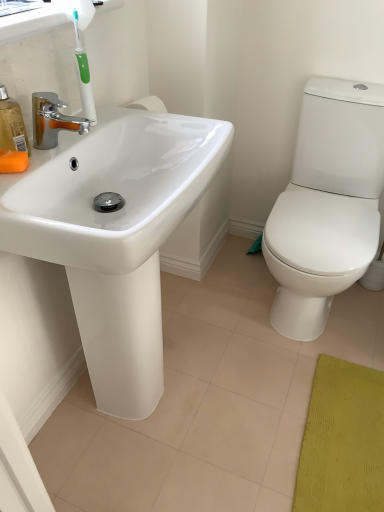
Question: Can we say white matte toilet paper at right lies outside orange matte soap at left?

Choices:
 (A) yes
 (B) no

Answer: (A)

Question: From a real-world perspective, is white matte toilet paper at right located beneath orange matte soap at left?

Choices:
 (A) no
 (B) yes

Answer: (B)

Question: Is white matte toilet paper at right oriented towards orange matte soap at left?

Choices:
 (A) no
 (B) yes

Answer: (A)

Question: Is white matte toilet paper at right taller than orange matte soap at left?

Choices:
 (A) yes
 (B) no

Answer: (A)

Question: From the image's perspective, is white matte toilet paper at right under orange matte soap at left?

Choices:
 (A) no
 (B) yes

Answer: (B)

Question: From the image's perspective, is white matte toilet paper at right over orange matte soap at left?

Choices:
 (A) yes
 (B) no

Answer: (B)

Question: Is orange matte soap at left not near translucent orange soap dispenser at left?

Choices:
 (A) no
 (B) yes

Answer: (A)

Question: Is orange matte soap at left beside translucent orange soap dispenser at left?

Choices:
 (A) yes
 (B) no

Answer: (A)

Question: Would you say orange matte soap at left is outside translucent orange soap dispenser at left?

Choices:
 (A) yes
 (B) no

Answer: (A)

Question: Is orange matte soap at left thinner than translucent orange soap dispenser at left?

Choices:
 (A) no
 (B) yes

Answer: (A)

Question: From a real-world perspective, is orange matte soap at left physically below translucent orange soap dispenser at left?

Choices:
 (A) no
 (B) yes

Answer: (B)

Question: Does orange matte soap at left have a greater height compared to translucent orange soap dispenser at left?

Choices:
 (A) yes
 (B) no

Answer: (B)

Question: Is white matte toilet paper at right in front of translucent orange soap dispenser at left?

Choices:
 (A) no
 (B) yes

Answer: (A)